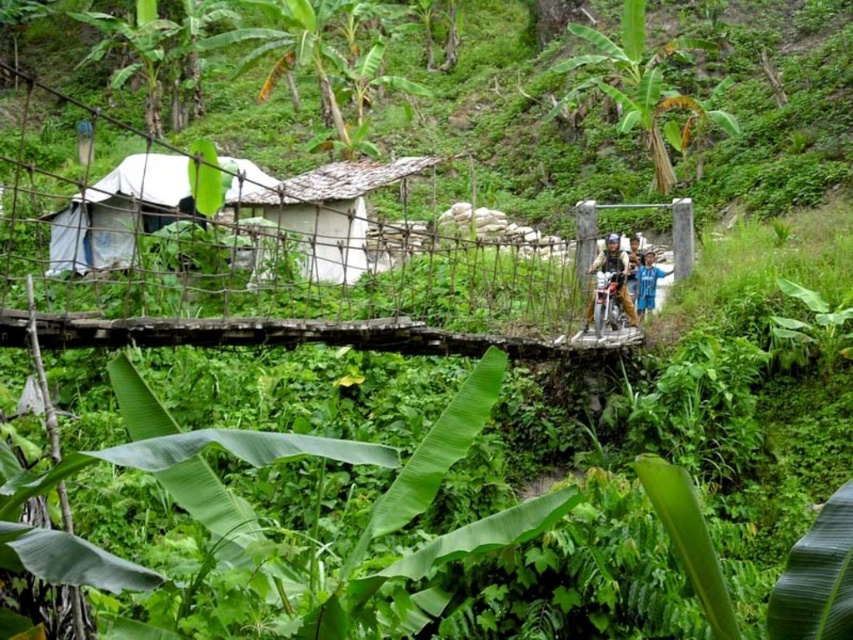
Based on the photo, is rope bridge at center thinner than metallic helmet at center?

Incorrect, rope bridge at center's width is not less than metallic helmet at center's.

Who is positioned more to the right, rope bridge at center or metallic helmet at center?

metallic helmet at center is more to the right.

Where is `rope bridge at center`? The width and height of the screenshot is (853, 640). rope bridge at center is located at coordinates (271, 333).

This screenshot has height=640, width=853. I want to click on rope bridge at center, so click(271, 333).

Does point (514, 148) come behind point (619, 241)?

Yes, it is.

Does point (850, 10) lie in front of point (607, 253)?

No, it is behind (607, 253).

Locate an element on the screen. This screenshot has width=853, height=640. green leafy hillside at upper center is located at coordinates (773, 104).

Can you confirm if white fabric tent at left is shorter than metallic helmet at center?

Incorrect, white fabric tent at left's height does not fall short of metallic helmet at center's.

The image size is (853, 640). Find the location of `white fabric tent at left`. white fabric tent at left is located at coordinates (119, 212).